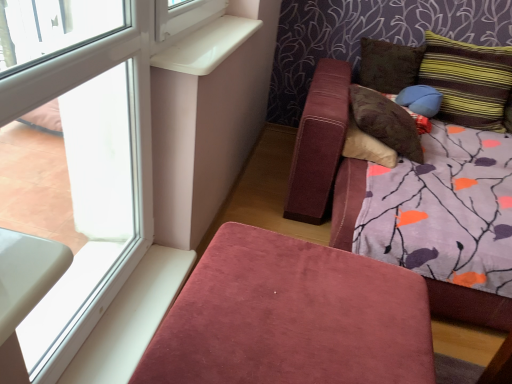
Identify the location of free spot above velvet pink ottoman at lower center (from a real-world perspective). (300, 302).